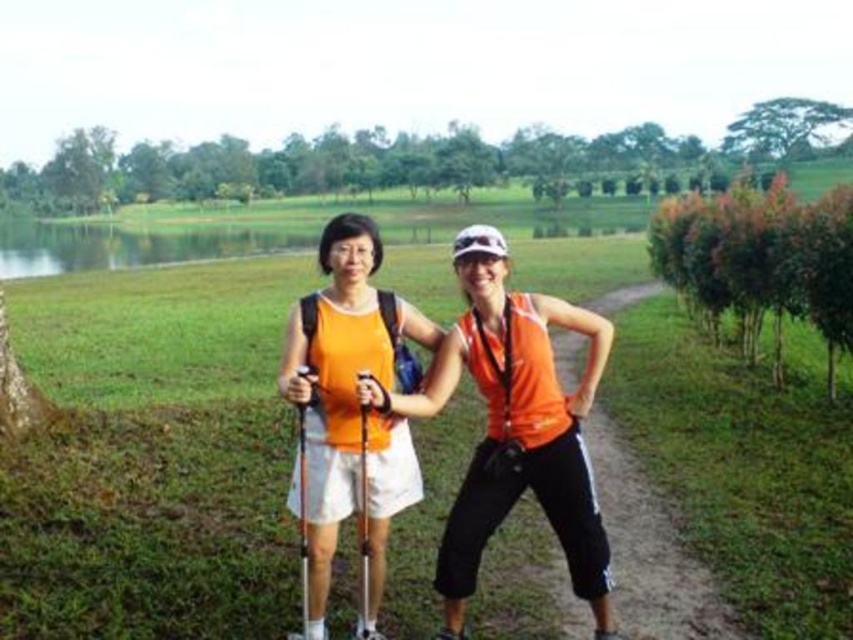
Question: Can you confirm if orange matte tank top at center is smaller than matte orange tank top at center?

Choices:
 (A) yes
 (B) no

Answer: (A)

Question: From the image, what is the correct spatial relationship of orange matte tank top at center in relation to matte orange tank top at center?

Choices:
 (A) right
 (B) left

Answer: (A)

Question: Considering the relative positions of orange matte tank top at center and matte orange tank top at center in the image provided, where is orange matte tank top at center located with respect to matte orange tank top at center?

Choices:
 (A) above
 (B) below

Answer: (B)

Question: Among these points, which one is nearest to the camera?

Choices:
 (A) (556, 451)
 (B) (370, 310)

Answer: (A)

Question: Which of the following is the closest to the observer?

Choices:
 (A) (408, 428)
 (B) (590, 481)

Answer: (B)